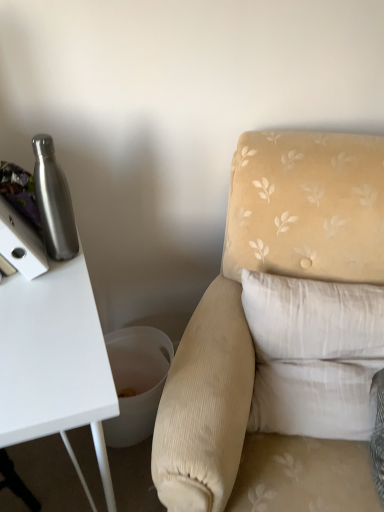
Question: From the image's perspective, is velvet beige armchair at center positioned above or below brushed metal water bottle at left?

Choices:
 (A) above
 (B) below

Answer: (B)

Question: Is velvet beige armchair at center situated inside brushed metal water bottle at left or outside?

Choices:
 (A) outside
 (B) inside

Answer: (A)

Question: Which of these objects is positioned farthest from the white cotton pillow at right?

Choices:
 (A) brushed metal water bottle at left
 (B) velvet beige armchair at center

Answer: (A)

Question: Which object is the farthest from the velvet beige armchair at center?

Choices:
 (A) white cotton pillow at right
 (B) brushed metal water bottle at left

Answer: (B)